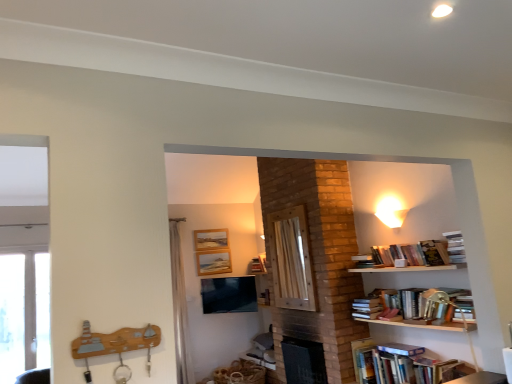
What do you see at coordinates (402, 365) in the screenshot? This screenshot has height=384, width=512. I see `hardcover books at lower right, marked as the 1th book in a bottom-to-top arrangement` at bounding box center [402, 365].

Describe the element at coordinates (213, 262) in the screenshot. The width and height of the screenshot is (512, 384). I see `wooden picture frame at upper center, the 1th picture frame in the bottom-to-top sequence` at that location.

What do you see at coordinates (455, 247) in the screenshot? I see `hardcover books at upper right, acting as the 1th book starting from the top` at bounding box center [455, 247].

This screenshot has height=384, width=512. Describe the element at coordinates (180, 306) in the screenshot. I see `translucent fabric curtain at center` at that location.

Find the location of a particular element. This screenshot has height=384, width=512. hardcover books at lower right, marked as the 1th book in a bottom-to-top arrangement is located at coordinates (402, 365).

How many degrees apart are the facing directions of wooden picture frame at upper center, the first picture frame from the top, and wooden picture frame at upper center, marked as the second picture frame in a top-to-bottom arrangement?

0.000794 degrees.

Where is `picture frame in front of the wooden picture frame at upper center, the first picture frame from the top`? picture frame in front of the wooden picture frame at upper center, the first picture frame from the top is located at coordinates (213, 262).

Can you confirm if wooden picture frame at upper center, positioned as the 2th picture frame in bottom-to-top order, is positioned to the right of wooden picture frame at upper center, the 1th picture frame in the bottom-to-top sequence?

Incorrect, wooden picture frame at upper center, positioned as the 2th picture frame in bottom-to-top order, is not on the right side of wooden picture frame at upper center, the 1th picture frame in the bottom-to-top sequence.

Is wooden picture frame at upper center, the first picture frame from the top, facing away from wooden picture frame at upper center, the 1th picture frame in the bottom-to-top sequence?

wooden picture frame at upper center, the first picture frame from the top, does not have its back to wooden picture frame at upper center, the 1th picture frame in the bottom-to-top sequence.

Consider the image. Can we say hardcover books at lower right, marked as the 1th book in a bottom-to-top arrangement, lies outside wooden picture frame at upper center, the first picture frame from the top?

Indeed, hardcover books at lower right, marked as the 1th book in a bottom-to-top arrangement, is completely outside wooden picture frame at upper center, the first picture frame from the top.

Considering the relative positions of hardcover books at lower right, marked as the 1th book in a bottom-to-top arrangement, and wooden picture frame at upper center, the first picture frame from the top, in the image provided, is hardcover books at lower right, marked as the 1th book in a bottom-to-top arrangement, behind wooden picture frame at upper center, the first picture frame from the top,?

No, it is in front of wooden picture frame at upper center, the first picture frame from the top.

Based on the photo, does hardcover books at lower right, marked as the 2th book in a top-to-bottom arrangement, have a smaller size compared to wooden picture frame at upper center, the first picture frame from the top?

No.

From their relative heights in the image, would you say wooden screen door at center is taller or shorter than translucent fabric curtain at center?

Considering their sizes, wooden screen door at center has less height than translucent fabric curtain at center.

Is wooden screen door at center touching translucent fabric curtain at center?

They are not placed beside each other.

From a real-world perspective, is wooden screen door at center over translucent fabric curtain at center?

Yes, from a real-world perspective, wooden screen door at center is on top of translucent fabric curtain at center.

Is wooden screen door at center aimed at translucent fabric curtain at center?

No, wooden screen door at center is not facing towards translucent fabric curtain at center.

From the image's perspective, is hardcover books at upper right, acting as the 1th book starting from the top, on transparent glass door at left?

Correct, hardcover books at upper right, acting as the 1th book starting from the top, appears higher than transparent glass door at left in the image.

Is hardcover books at upper right, acting as the second book starting from the bottom, positioned with its back to transparent glass door at left?

No, hardcover books at upper right, acting as the second book starting from the bottom, is not facing the opposite direction of transparent glass door at left.

Is hardcover books at upper right, acting as the second book starting from the bottom, with transparent glass door at left?

No, hardcover books at upper right, acting as the second book starting from the bottom, is not beside transparent glass door at left.

Which point is more forward, (462, 243) or (16, 285)?

The point (462, 243) is in front.

What's the angular difference between translucent fabric curtain at center and hardcover books at upper right, acting as the second book starting from the bottom,'s facing directions?

The facing directions of translucent fabric curtain at center and hardcover books at upper right, acting as the second book starting from the bottom, are 91.1 degrees apart.

Which is farther from the camera, (181, 306) or (459, 243)?

The point (181, 306) is farther from the camera.

Can you confirm if translucent fabric curtain at center is taller than hardcover books at upper right, acting as the 1th book starting from the top?

Yes.

Based on the photo, considering the sizes of objects translucent fabric curtain at center and hardcover books at upper right, acting as the 1th book starting from the top, in the image provided, who is thinner, translucent fabric curtain at center or hardcover books at upper right, acting as the 1th book starting from the top,?

hardcover books at upper right, acting as the 1th book starting from the top, is thinner.

From the hardcover books at upper right, acting as the 1th book starting from the top, count 2nd picture frames backward and point to it. Please provide its 2D coordinates.

[(211, 239)]

Is wooden picture frame at upper center, positioned as the 2th picture frame in bottom-to-top order, not near hardcover books at upper right, acting as the 1th book starting from the top?

wooden picture frame at upper center, positioned as the 2th picture frame in bottom-to-top order, is positioned a significant distance from hardcover books at upper right, acting as the 1th book starting from the top.

Is wooden picture frame at upper center, positioned as the 2th picture frame in bottom-to-top order, turned away from hardcover books at upper right, acting as the 1th book starting from the top?

No, wooden picture frame at upper center, positioned as the 2th picture frame in bottom-to-top order, is not facing the opposite direction of hardcover books at upper right, acting as the 1th book starting from the top.

Between point (208, 237) and point (457, 239), which one is positioned behind?

Point (208, 237)

From the image's perspective, between hardcover books at upper right, acting as the 1th book starting from the top, and wooden screen door at center, which one is located above?

hardcover books at upper right, acting as the 1th book starting from the top.

From a real-world perspective, which object stands above the other?

wooden screen door at center is physically above.

In terms of width, does hardcover books at upper right, acting as the 1th book starting from the top, look wider or thinner when compared to wooden screen door at center?

Considering their sizes, hardcover books at upper right, acting as the 1th book starting from the top, looks broader than wooden screen door at center.

Is the surface of hardcover books at upper right, acting as the 1th book starting from the top, in direct contact with wooden screen door at center?

No, hardcover books at upper right, acting as the 1th book starting from the top, is not beside wooden screen door at center.

Locate an element on the screen. The width and height of the screenshot is (512, 384). picture frame on the left of wooden picture frame at upper center, the 1th picture frame in the bottom-to-top sequence is located at coordinates (x=211, y=239).

From a real-world perspective, starting from the hardcover books at lower right, marked as the 2th book in a top-to-bottom arrangement, which picture frame is the 2nd one vertically above it? Please provide its 2D coordinates.

[(211, 239)]

When comparing their distances from transparent glass door at left, does translucent fabric curtain at center or hardcover books at upper right, acting as the 1th book starting from the top, seem closer?

Among the two, translucent fabric curtain at center is located nearer to transparent glass door at left.

From the image, which object appears to be farther from wooden picture frame at upper center, positioned as the 2th picture frame in bottom-to-top order, hardcover books at upper right, acting as the second book starting from the bottom, or hardcover books at lower right, marked as the 1th book in a bottom-to-top arrangement?

Based on the image, hardcover books at upper right, acting as the second book starting from the bottom, appears to be further to wooden picture frame at upper center, positioned as the 2th picture frame in bottom-to-top order.

From the image, which object appears to be nearer to transparent glass door at left, wooden picture frame at upper center, marked as the second picture frame in a top-to-bottom arrangement, or matte black tv at center?

Based on the image, matte black tv at center appears to be nearer to transparent glass door at left.

When comparing their distances from transparent glass door at left, does matte black tv at center or wooden picture frame at upper center, the first picture frame from the top, seem closer?

Among the two, matte black tv at center is located nearer to transparent glass door at left.

Which object lies further to the anchor point wooden picture frame at upper center, positioned as the 2th picture frame in bottom-to-top order, wooden screen door at center or translucent fabric curtain at center?

wooden screen door at center lies further to wooden picture frame at upper center, positioned as the 2th picture frame in bottom-to-top order, than the other object.

Based on their spatial positions, is wooden picture frame at upper center, positioned as the 2th picture frame in bottom-to-top order, or hardcover books at lower right, marked as the 1th book in a bottom-to-top arrangement, further from transparent glass door at left?

The object further to transparent glass door at left is hardcover books at lower right, marked as the 1th book in a bottom-to-top arrangement.

Based on their spatial positions, is wooden screen door at center or wooden picture frame at upper center, marked as the second picture frame in a top-to-bottom arrangement, closer to matte black tv at center?

wooden picture frame at upper center, marked as the second picture frame in a top-to-bottom arrangement, is closer to matte black tv at center.

From the image, which object appears to be nearer to transparent glass door at left, wooden picture frame at upper center, the first picture frame from the top, or wooden screen door at center?

wooden picture frame at upper center, the first picture frame from the top.

Find the location of a particular element. screen door located between translucent fabric curtain at center and hardcover books at lower right, marked as the 2th book in a top-to-bottom arrangement, in the left-right direction is located at coordinates (291, 260).

Find the location of a particular element. This screenshot has height=384, width=512. curtain between transparent glass door at left and wooden picture frame at upper center, the 1th picture frame in the bottom-to-top sequence, in the horizontal direction is located at coordinates (180, 306).

This screenshot has height=384, width=512. What are the coordinates of `screen door positioned between hardcover books at upper right, acting as the second book starting from the bottom, and wooden picture frame at upper center, positioned as the 2th picture frame in bottom-to-top order, from near to far` in the screenshot? It's located at (291, 260).

Locate an element on the screen. screen door situated between translucent fabric curtain at center and hardcover books at upper right, acting as the 1th book starting from the top, from left to right is located at coordinates (291, 260).